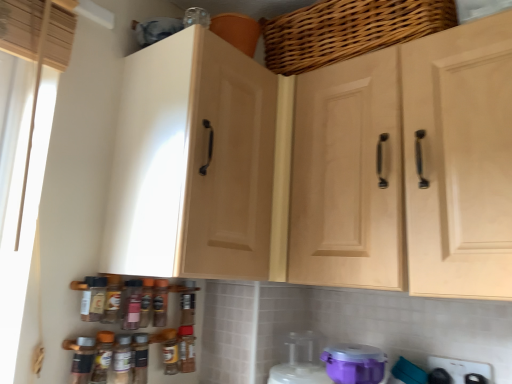
Question: Is purple plastic container at lower center, which is counted as the 3th appliance, starting from the right, shorter than light wood cabinet doors at center, positioned as the 1th cabinetry in right-to-left order?

Choices:
 (A) yes
 (B) no

Answer: (A)

Question: Can you see purple plastic container at lower center, the second appliance positioned from the left, touching light wood cabinet doors at center, which is counted as the 2th cabinetry, starting from the left?

Choices:
 (A) no
 (B) yes

Answer: (A)

Question: Does purple plastic container at lower center, the second appliance positioned from the left, have a larger size compared to light wood cabinet doors at center, positioned as the 1th cabinetry in right-to-left order?

Choices:
 (A) no
 (B) yes

Answer: (A)

Question: Can you confirm if purple plastic container at lower center, the second appliance positioned from the left, is smaller than light wood cabinet doors at center, which is counted as the 2th cabinetry, starting from the left?

Choices:
 (A) no
 (B) yes

Answer: (B)

Question: Is the position of purple plastic container at lower center, which is counted as the 3th appliance, starting from the right, less distant than that of light wood cabinet doors at center, which is counted as the 2th cabinetry, starting from the left?

Choices:
 (A) yes
 (B) no

Answer: (B)

Question: Is woven wood basket at upper center taller or shorter than purple plastic container at lower center, the third appliance from the left?

Choices:
 (A) tall
 (B) short

Answer: (A)

Question: Looking at the image, does woven wood basket at upper center seem bigger or smaller compared to purple plastic container at lower center, the third appliance from the left?

Choices:
 (A) small
 (B) big

Answer: (B)

Question: Is woven wood basket at upper center to the left or to the right of purple plastic container at lower center, the third appliance from the left, in the image?

Choices:
 (A) right
 (B) left

Answer: (A)

Question: Is woven wood basket at upper center inside the boundaries of purple plastic container at lower center, the third appliance from the left, or outside?

Choices:
 (A) inside
 (B) outside

Answer: (B)

Question: From the image's perspective, is white glossy stove at lower right, the first appliance viewed from the right, located above or below matte wood cabinet at left, the 2th cabinetry positioned from the right?

Choices:
 (A) above
 (B) below

Answer: (B)

Question: Considering the positions of point (428, 357) and point (262, 279), is point (428, 357) closer or farther from the camera than point (262, 279)?

Choices:
 (A) farther
 (B) closer

Answer: (A)

Question: Is white glossy stove at lower right, the first appliance viewed from the right, in front of or behind matte wood cabinet at left, the 2th cabinetry positioned from the right, in the image?

Choices:
 (A) behind
 (B) front

Answer: (A)

Question: Visually, is white glossy stove at lower right, the first appliance viewed from the right, positioned to the left or to the right of matte wood cabinet at left, the 2th cabinetry positioned from the right?

Choices:
 (A) left
 (B) right

Answer: (B)

Question: Considering the relative positions of purple plastic container at lower center, the 4th appliance from the right, and light wood cabinet doors at center, which is counted as the 2th cabinetry, starting from the left, in the image provided, is purple plastic container at lower center, the 4th appliance from the right, to the left or to the right of light wood cabinet doors at center, which is counted as the 2th cabinetry, starting from the left,?

Choices:
 (A) right
 (B) left

Answer: (B)

Question: Considering the positions of purple plastic container at lower center, the 4th appliance from the right, and light wood cabinet doors at center, positioned as the 1th cabinetry in right-to-left order, in the image, is purple plastic container at lower center, the 4th appliance from the right, taller or shorter than light wood cabinet doors at center, positioned as the 1th cabinetry in right-to-left order,?

Choices:
 (A) tall
 (B) short

Answer: (B)